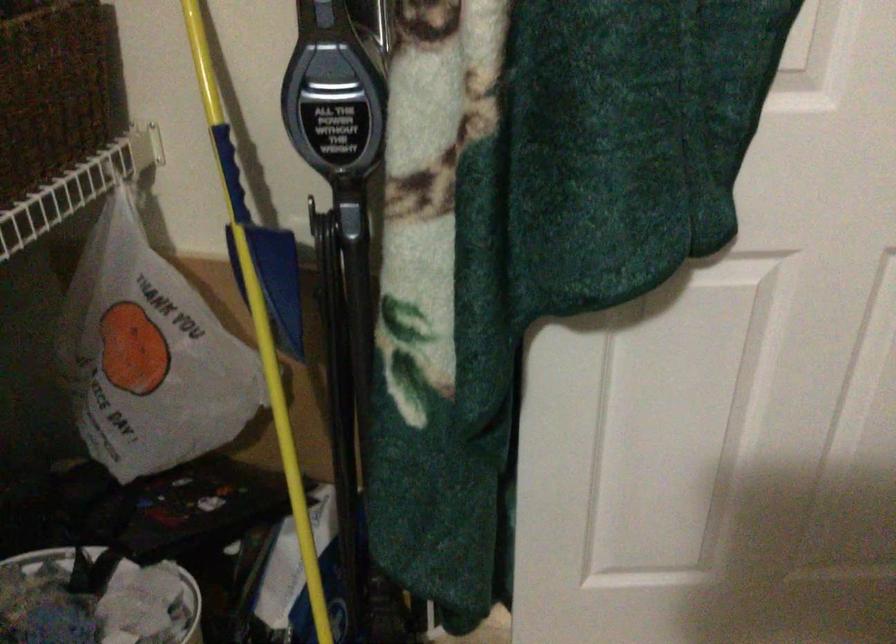
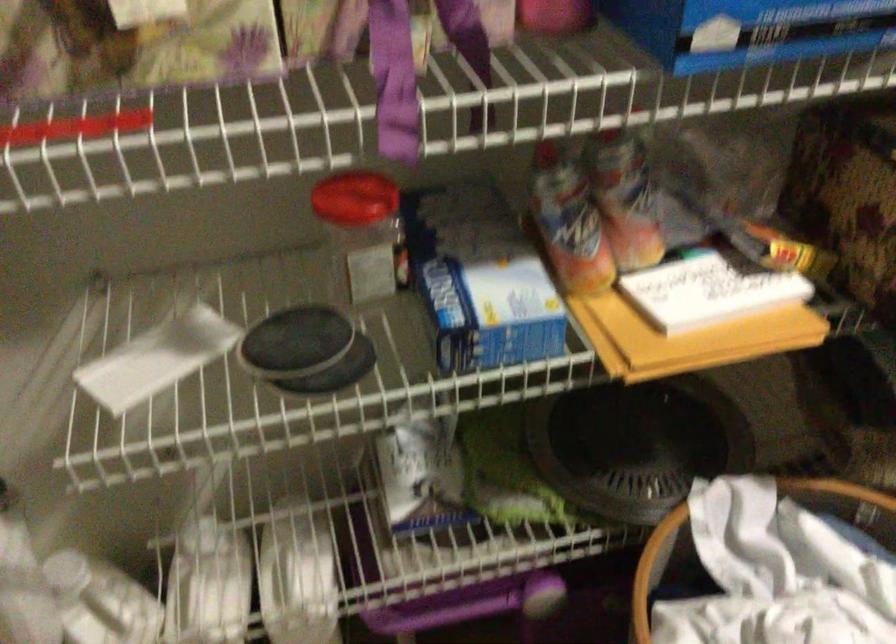
How did the camera likely rotate?

The camera rotated toward right-down.